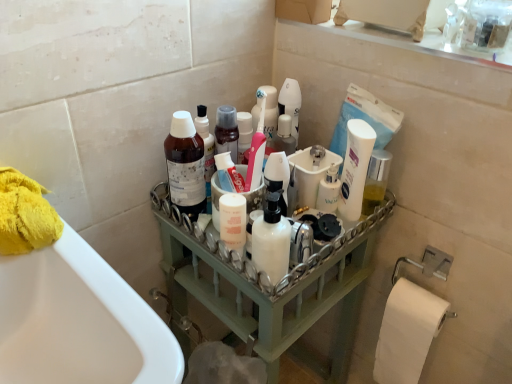
Question: Can you confirm if white matte pump bottle at center, the second cleaning product when ordered from left to right, is shorter than white glossy mouthwash at center?

Choices:
 (A) no
 (B) yes

Answer: (B)

Question: Does white matte pump bottle at center, the second cleaning product viewed from the back, have a smaller size compared to white glossy mouthwash at center?

Choices:
 (A) yes
 (B) no

Answer: (A)

Question: Is white matte pump bottle at center, placed as the first cleaning product when sorted from front to back, thinner than white glossy mouthwash at center?

Choices:
 (A) no
 (B) yes

Answer: (A)

Question: Is white matte pump bottle at center, the second cleaning product viewed from the back, next to white glossy mouthwash at center and touching it?

Choices:
 (A) no
 (B) yes

Answer: (A)

Question: Does white matte pump bottle at center, placed as the first cleaning product when sorted from front to back, have a greater height compared to white glossy mouthwash at center?

Choices:
 (A) yes
 (B) no

Answer: (B)

Question: Is translucent plastic bottle at upper center, acting as the first cleaning product starting from the left, in front of or behind white matte pump bottle at center, placed as the first cleaning product when sorted from front to back, in the image?

Choices:
 (A) behind
 (B) front

Answer: (A)

Question: Considering the positions of translucent plastic bottle at upper center, acting as the first cleaning product starting from the left, and white matte pump bottle at center, the first cleaning product when ordered from right to left, in the image, is translucent plastic bottle at upper center, acting as the first cleaning product starting from the left, taller or shorter than white matte pump bottle at center, the first cleaning product when ordered from right to left,?

Choices:
 (A) short
 (B) tall

Answer: (B)

Question: In terms of width, does translucent plastic bottle at upper center, acting as the first cleaning product starting from the left, look wider or thinner when compared to white matte pump bottle at center, placed as the first cleaning product when sorted from front to back?

Choices:
 (A) wide
 (B) thin

Answer: (A)

Question: Is translucent plastic bottle at upper center, the first cleaning product positioned from the back, bigger or smaller than white matte pump bottle at center, the first cleaning product when ordered from right to left?

Choices:
 (A) big
 (B) small

Answer: (A)

Question: In terms of size, does yellow fluffy towel at left appear bigger or smaller than green wood tray at center?

Choices:
 (A) big
 (B) small

Answer: (B)

Question: From the image's perspective, is yellow fluffy towel at left above or below green wood tray at center?

Choices:
 (A) above
 (B) below

Answer: (A)

Question: Is yellow fluffy towel at left in front of or behind green wood tray at center in the image?

Choices:
 (A) front
 (B) behind

Answer: (A)

Question: Considering the relative positions of yellow fluffy towel at left and green wood tray at center in the image provided, is yellow fluffy towel at left to the left or to the right of green wood tray at center?

Choices:
 (A) right
 (B) left

Answer: (B)

Question: Considering the relative positions of translucent plastic bottle at upper center, the first cleaning product positioned from the back, and green wood tray at center in the image provided, is translucent plastic bottle at upper center, the first cleaning product positioned from the back, to the left or to the right of green wood tray at center?

Choices:
 (A) right
 (B) left

Answer: (B)

Question: Do you think translucent plastic bottle at upper center, the second cleaning product viewed from the front, is within green wood tray at center, or outside of it?

Choices:
 (A) inside
 (B) outside

Answer: (B)